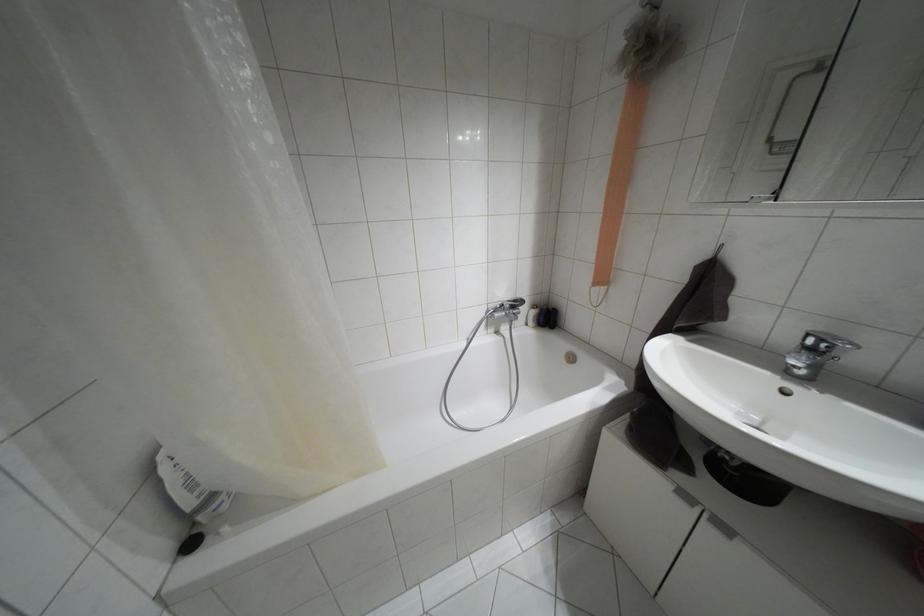
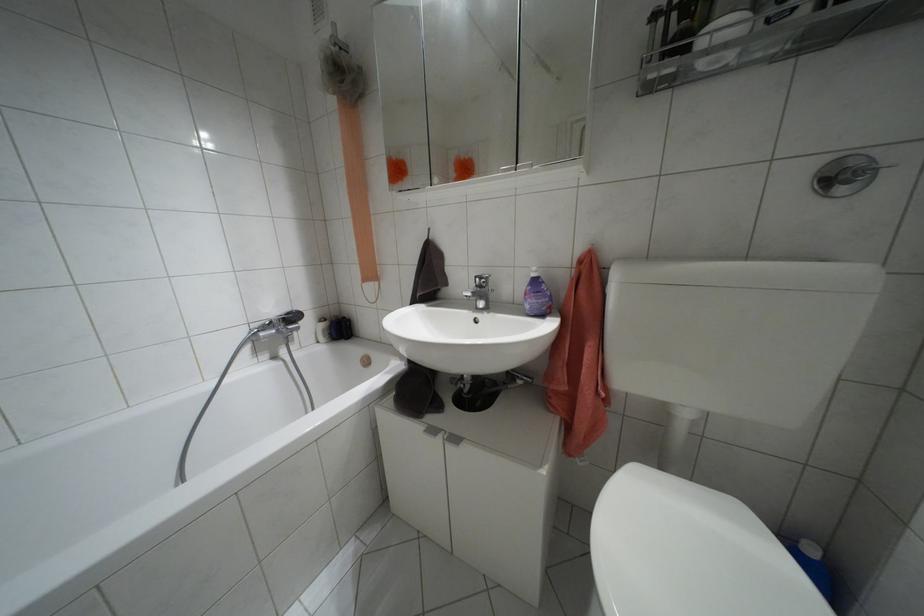
Where in the second image is the point corresponding to (723,528) from the first image?

(455, 439)